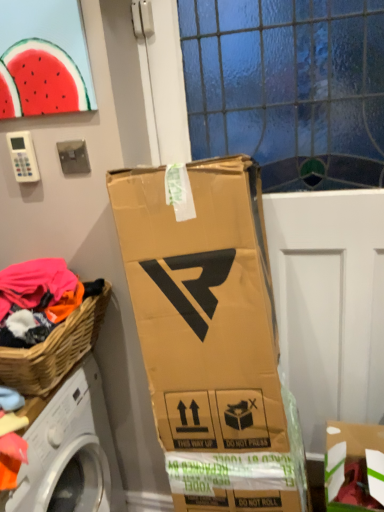
Question: Can you confirm if woven wood picnic basket at lower left is positioned to the left of watermelon at upper left?

Choices:
 (A) no
 (B) yes

Answer: (B)

Question: Is woven wood picnic basket at lower left further to the viewer compared to watermelon at upper left?

Choices:
 (A) yes
 (B) no

Answer: (B)

Question: Is woven wood picnic basket at lower left completely or partially outside of watermelon at upper left?

Choices:
 (A) yes
 (B) no

Answer: (A)

Question: Could you tell me if woven wood picnic basket at lower left is facing watermelon at upper left?

Choices:
 (A) no
 (B) yes

Answer: (A)

Question: Does woven wood picnic basket at lower left have a greater width compared to watermelon at upper left?

Choices:
 (A) no
 (B) yes

Answer: (B)

Question: Is woven wood picnic basket at lower left taller than watermelon at upper left?

Choices:
 (A) no
 (B) yes

Answer: (A)

Question: Does white plastic washing machine at lower left have a lesser height compared to woven wood picnic basket at lower left?

Choices:
 (A) yes
 (B) no

Answer: (B)

Question: Does white plastic washing machine at lower left appear on the left side of woven wood picnic basket at lower left?

Choices:
 (A) no
 (B) yes

Answer: (B)

Question: Is the position of white plastic washing machine at lower left less distant than that of woven wood picnic basket at lower left?

Choices:
 (A) yes
 (B) no

Answer: (A)

Question: Is white plastic washing machine at lower left looking in the opposite direction of woven wood picnic basket at lower left?

Choices:
 (A) no
 (B) yes

Answer: (A)

Question: Is white plastic washing machine at lower left in contact with woven wood picnic basket at lower left?

Choices:
 (A) yes
 (B) no

Answer: (B)

Question: Can you confirm if white plastic washing machine at lower left is thinner than woven wood picnic basket at lower left?

Choices:
 (A) yes
 (B) no

Answer: (B)

Question: Can you confirm if watermelon at upper left is shorter than cardboard box at lower right?

Choices:
 (A) no
 (B) yes

Answer: (B)